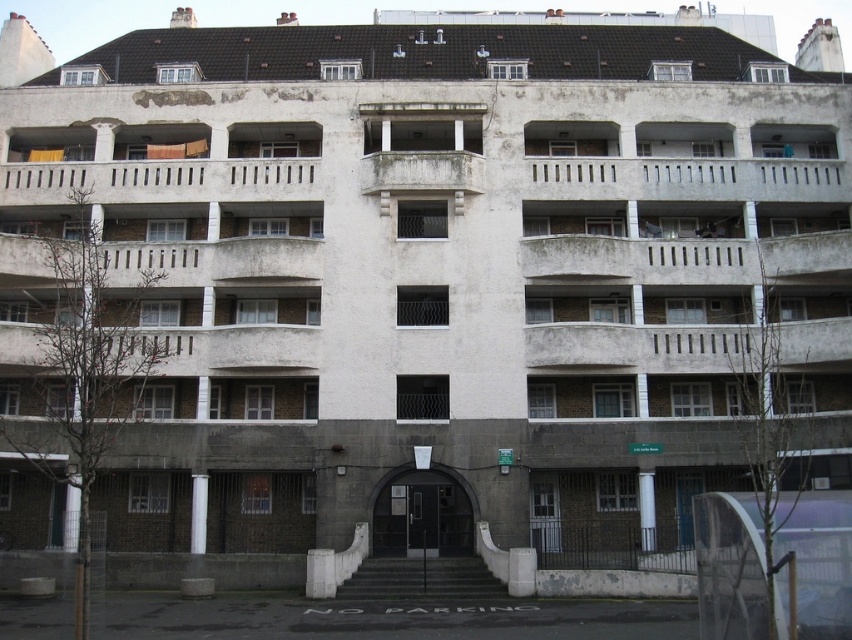
Consider the image. You are standing on the sidewalk in front of the building and want to enter through the entrance. Which object, the white concrete balcony at center or the dark gray concrete stairs at center, is closer to you as you approach the building?

The dark gray concrete stairs at center are closer to you because the white concrete balcony at center is further away, so you would reach the dark gray concrete stairs at center first when approaching the building.

Based on the photo, you are a delivery person approaching the entrance of the building. You see the white concrete balcony at upper center and the dark gray concrete stairs at center. Which object is closer to your current position?

The dark gray concrete stairs at center is closer to your current position because it is in front of the white concrete balcony at upper center.